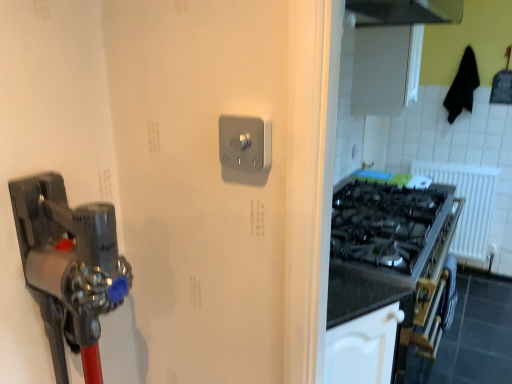
Question: Considering the positions of point (465, 253) and point (222, 139), is point (465, 253) closer or farther from the camera than point (222, 139)?

Choices:
 (A) farther
 (B) closer

Answer: (A)

Question: From a real-world perspective, is white plastic radiator at right physically located above or below satin silver switch at center?

Choices:
 (A) above
 (B) below

Answer: (B)

Question: Choose the correct answer: Is white plastic radiator at right inside satin silver switch at center or outside it?

Choices:
 (A) inside
 (B) outside

Answer: (B)

Question: Visually, is satin silver switch at center positioned to the left or to the right of white plastic radiator at right?

Choices:
 (A) right
 (B) left

Answer: (B)

Question: Does point (241, 150) appear closer or farther from the camera than point (480, 238)?

Choices:
 (A) closer
 (B) farther

Answer: (A)

Question: Is satin silver switch at center taller or shorter than white plastic radiator at right?

Choices:
 (A) tall
 (B) short

Answer: (B)

Question: From the image's perspective, relative to white plastic radiator at right, is satin silver switch at center above or below?

Choices:
 (A) above
 (B) below

Answer: (A)